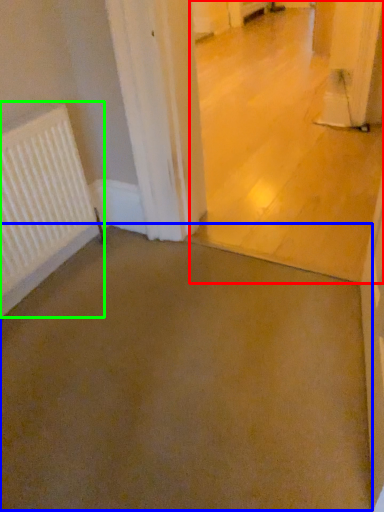
Question: Which is nearer to the concrete (highlighted by a red box)? concrete (highlighted by a blue box) or radiator (highlighted by a green box).

Choices:
 (A) concrete
 (B) radiator

Answer: (A)